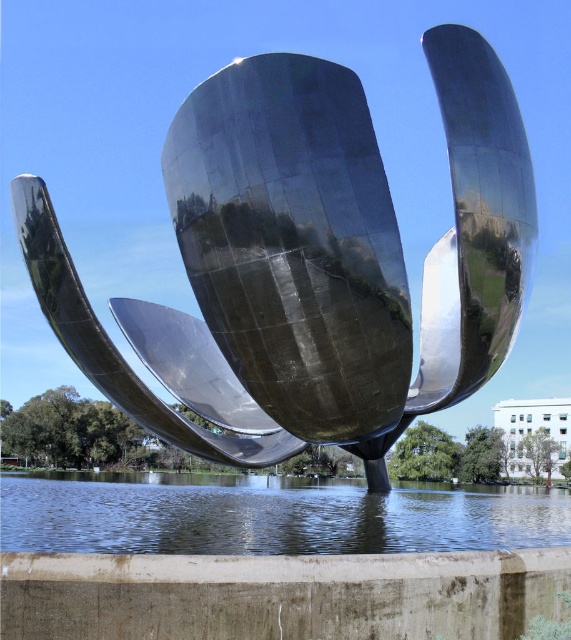
Question: Which object appears closest to the camera in this image?

Choices:
 (A) polished metal flower at center
 (B) transparent water at lower center

Answer: (B)

Question: Is polished metal flower at center above transparent water at lower center?

Choices:
 (A) yes
 (B) no

Answer: (A)

Question: Is polished metal flower at center further to camera compared to transparent water at lower center?

Choices:
 (A) no
 (B) yes

Answer: (B)

Question: Is polished metal flower at center bigger than transparent water at lower center?

Choices:
 (A) yes
 (B) no

Answer: (B)